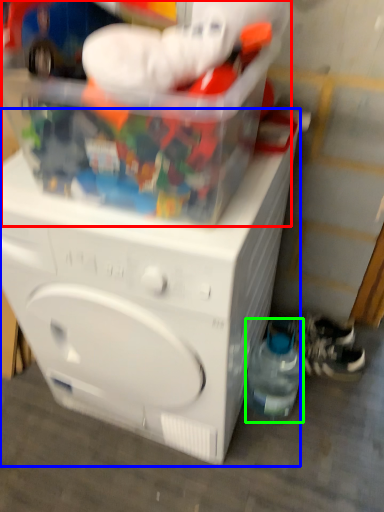
Question: Estimate the real-world distances between objects in this image. Which object is farther from toy (highlighted by a red box), washing machine (highlighted by a blue box) or bottle (highlighted by a green box)?

Choices:
 (A) washing machine
 (B) bottle

Answer: (B)